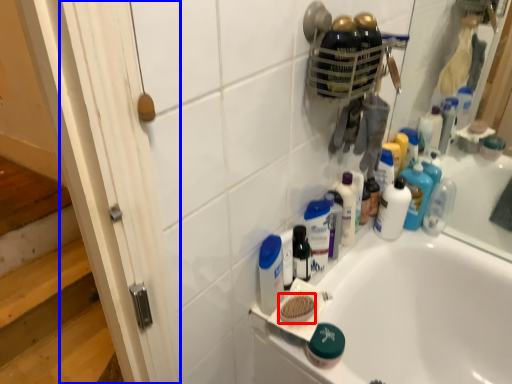
Question: Which of the following is the closest to the observer, soap (highlighted by a red box) or screen door (highlighted by a blue box)?

Choices:
 (A) soap
 (B) screen door

Answer: (B)